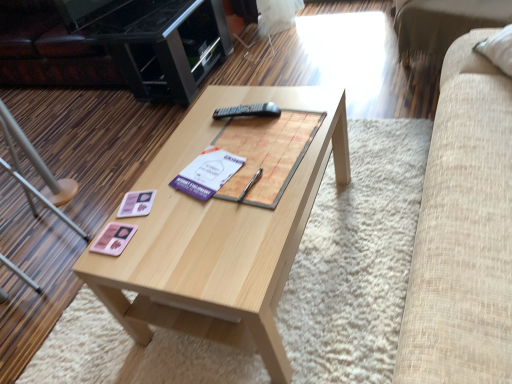
Image resolution: width=512 pixels, height=384 pixels. Identify the location of free space between black plastic remote at center and pink matte card game at center. (188, 165).